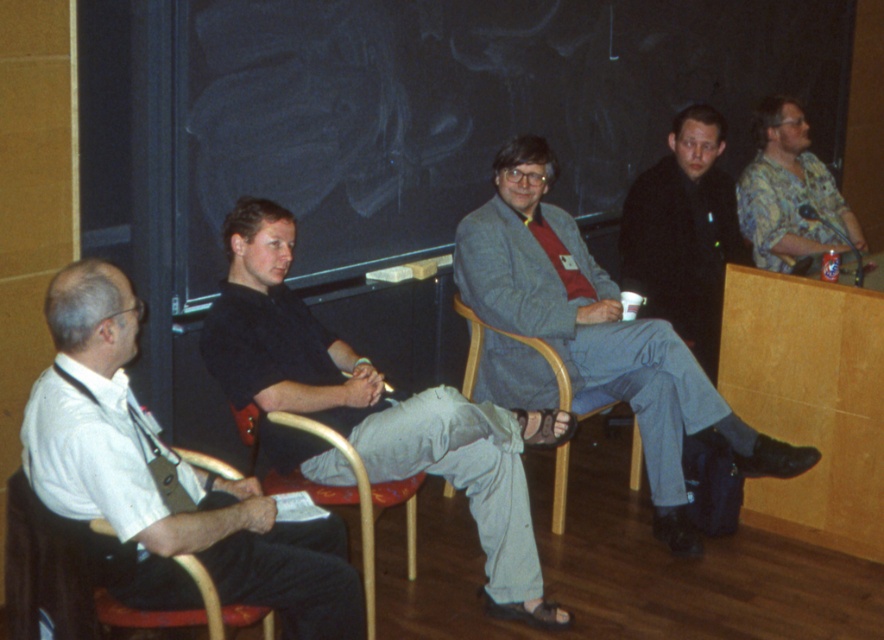
Is point (591, 244) less distant than point (212, 552)?

No, (591, 244) is further to viewer.

Does point (471, 209) lie behind point (249, 492)?

Yes, it is.

Where is `blackboard at upper center`? Image resolution: width=884 pixels, height=640 pixels. blackboard at upper center is located at coordinates (439, 115).

Is dark gray suit at center in front of wooden chair at center?

No, it is behind wooden chair at center.

Is point (715, 168) more distant than point (543, 346)?

Yes, point (715, 168) is behind point (543, 346).

The image size is (884, 640). Identify the location of dark gray suit at center. (683, 234).

The width and height of the screenshot is (884, 640). In order to click on dark gray suit at center in this screenshot , I will do `click(683, 234)`.

Who is taller, blackboard at upper center or dark gray suit at center?

blackboard at upper center

Between blackboard at upper center and dark gray suit at center, which one appears on the left side from the viewer's perspective?

blackboard at upper center

Is point (585, 13) positioned behind point (705, 150)?

Yes, it is behind point (705, 150).

Locate an element on the screen. The width and height of the screenshot is (884, 640). blackboard at upper center is located at coordinates (439, 115).